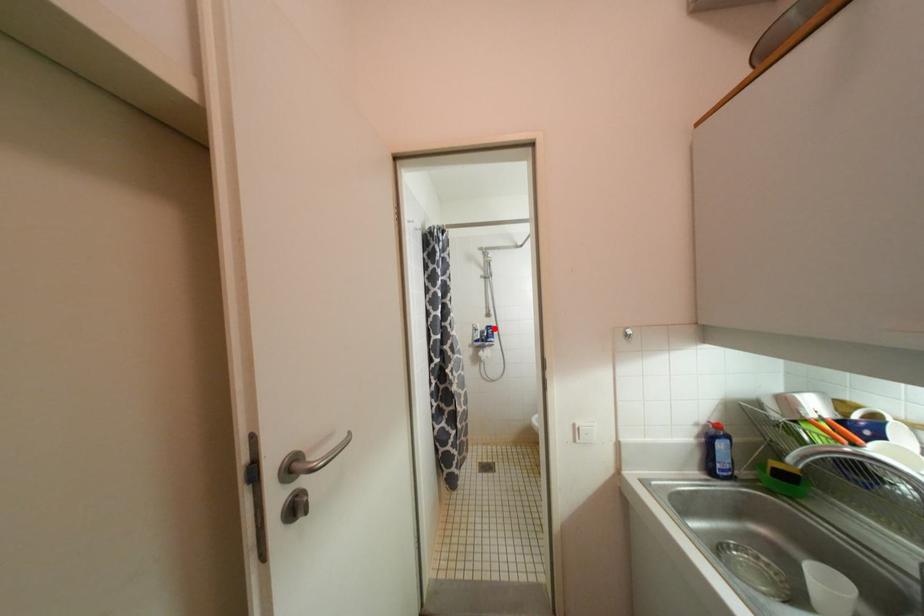
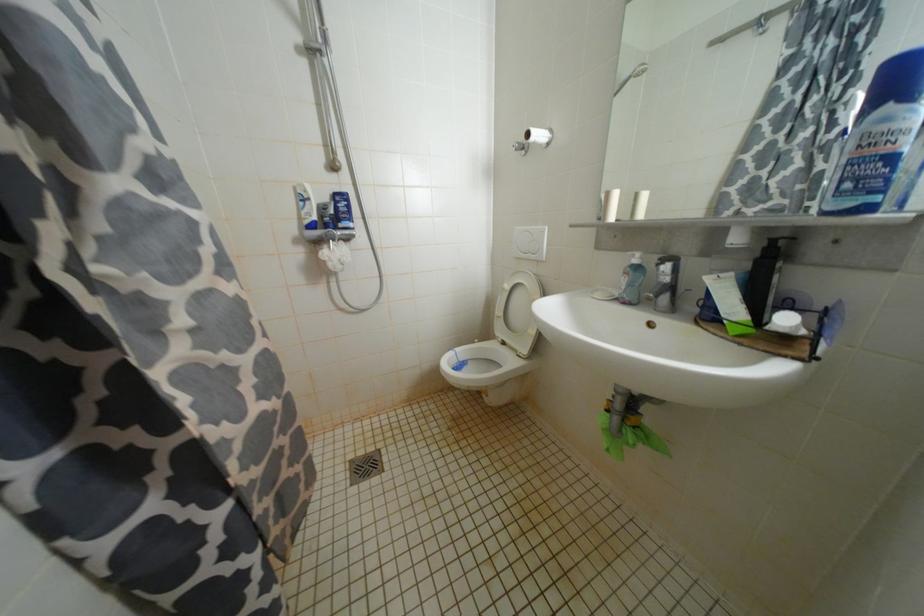
Locate, in the second image, the point that corresponds to the highlighted location in the first image.

(345, 198)